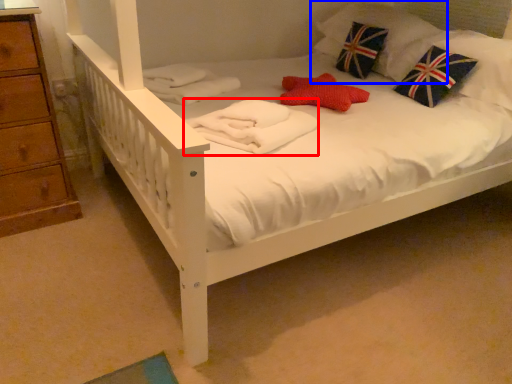
Question: Which of the following is the closest to the observer, material (highlighted by a red box) or pillow (highlighted by a blue box)?

Choices:
 (A) material
 (B) pillow

Answer: (A)